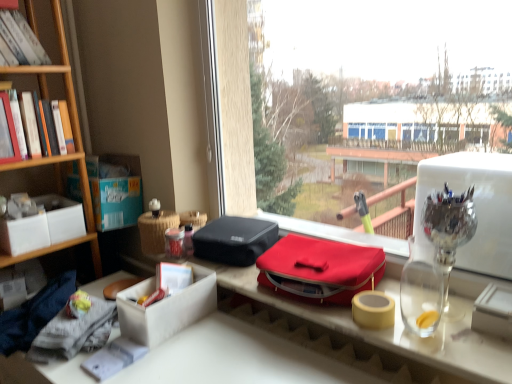
Question: Considering the relative sizes of transparent glass window at center and hardcover book at left in the image provided, is transparent glass window at center wider than hardcover book at left?

Choices:
 (A) no
 (B) yes

Answer: (B)

Question: Would you consider transparent glass window at center to be distant from hardcover book at left?

Choices:
 (A) yes
 (B) no

Answer: (A)

Question: Can you confirm if transparent glass window at center is bigger than hardcover book at left?

Choices:
 (A) no
 (B) yes

Answer: (B)

Question: Is transparent glass window at center looking in the opposite direction of hardcover book at left?

Choices:
 (A) yes
 (B) no

Answer: (B)

Question: From the image's perspective, does transparent glass window at center appear lower than hardcover book at left?

Choices:
 (A) no
 (B) yes

Answer: (B)

Question: Looking at their shapes, would you say transparent glass pen holder at upper right is wider or thinner than transparent glass window at center?

Choices:
 (A) wide
 (B) thin

Answer: (A)

Question: Visually, is transparent glass pen holder at upper right positioned to the left or to the right of transparent glass window at center?

Choices:
 (A) left
 (B) right

Answer: (B)

Question: Choose the correct answer: Is transparent glass pen holder at upper right inside transparent glass window at center or outside it?

Choices:
 (A) outside
 (B) inside

Answer: (A)

Question: Does point (433, 205) appear closer or farther from the camera than point (390, 150)?

Choices:
 (A) closer
 (B) farther

Answer: (A)

Question: Is point (118, 193) closer or farther from the camera than point (510, 375)?

Choices:
 (A) closer
 (B) farther

Answer: (B)

Question: Is cardboard box at left situated inside white cardboard box at center or outside?

Choices:
 (A) outside
 (B) inside

Answer: (A)

Question: From a real-world perspective, is cardboard box at left positioned above or below white cardboard box at center?

Choices:
 (A) above
 (B) below

Answer: (A)

Question: Looking at their shapes, would you say cardboard box at left is wider or thinner than white cardboard box at center?

Choices:
 (A) thin
 (B) wide

Answer: (A)

Question: Would you say white cardboard box at center is to the left or to the right of white matte box at left in the picture?

Choices:
 (A) right
 (B) left

Answer: (A)

Question: From a real-world perspective, relative to white matte box at left, is white cardboard box at center vertically above or below?

Choices:
 (A) below
 (B) above

Answer: (A)